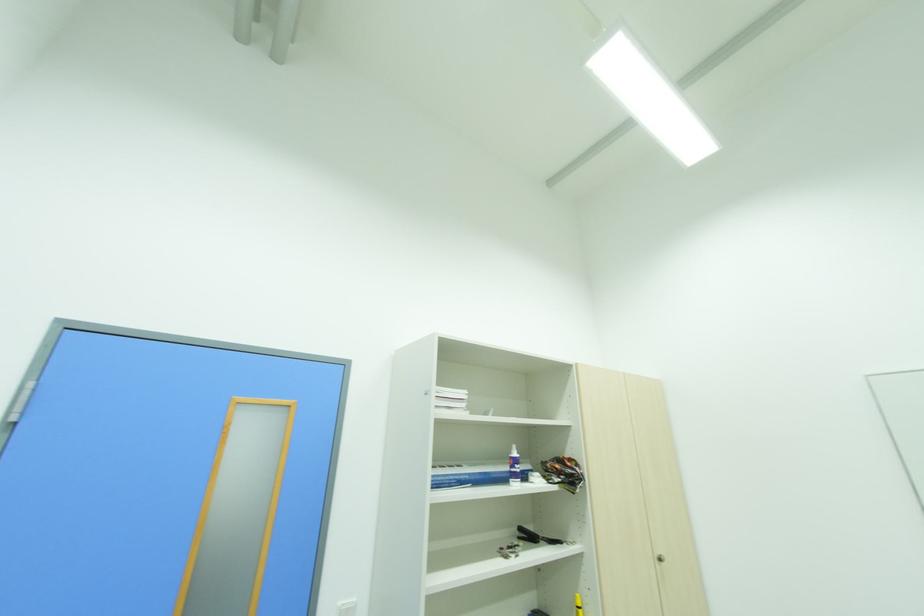
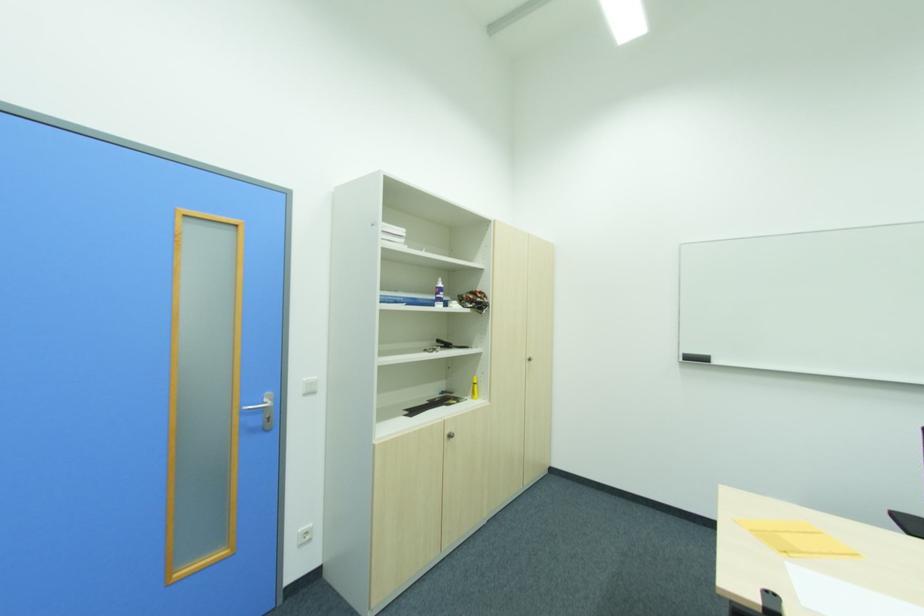
From the picture: The images are taken continuously from a first-person perspective. In which direction are you moving?

The movement direction of the cameraman is left, backward.